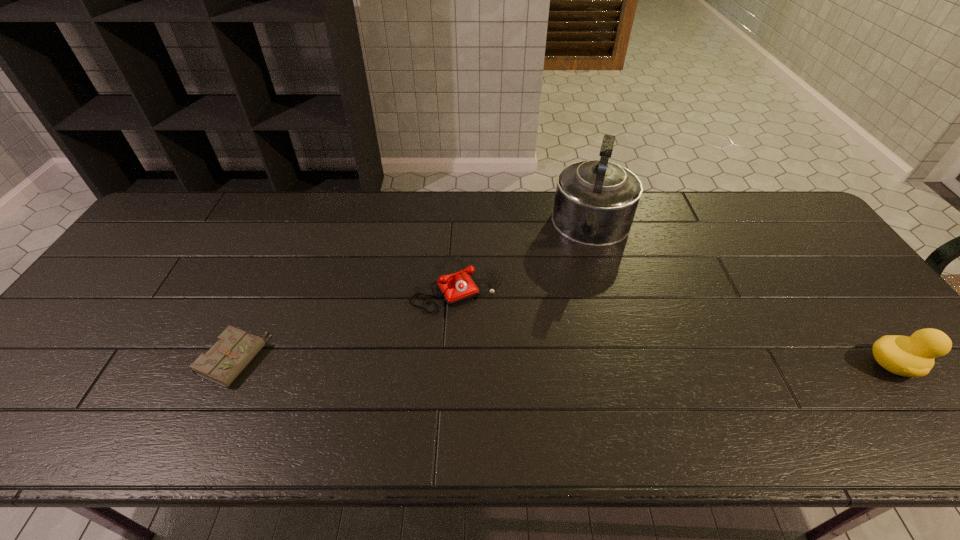
I want to click on vacant space situated 0.200m with the spout at the front of the kettle, so click(578, 311).

Where is `free location located with the spout at the front of the kettle`? free location located with the spout at the front of the kettle is located at coordinates (585, 282).

Where is `vacant space located on the dial of the telephone`? vacant space located on the dial of the telephone is located at coordinates (505, 358).

I want to click on free point located 0.150m on the dial of the telephone, so click(503, 355).

This screenshot has height=540, width=960. I want to click on blank area located on the dial of the telephone, so click(511, 368).

You are a GUI agent. You are given a task and a screenshot of the screen. Output one action in this format:
    pyautogui.click(x=<x>, y=<y>)
    Task: Click on the object located in the far edge section of the desktop
    This screenshot has width=960, height=540.
    Given the screenshot: What is the action you would take?
    tap(595, 202)

Locate an element on the screen. The height and width of the screenshot is (540, 960). diary that is at the near edge is located at coordinates (224, 361).

Identify the location of duck that is at the near edge. (913, 356).

Identify the location of object that is at the right edge. This screenshot has width=960, height=540. (913, 356).

Identify the location of object present at the near right corner. Image resolution: width=960 pixels, height=540 pixels. (913, 356).